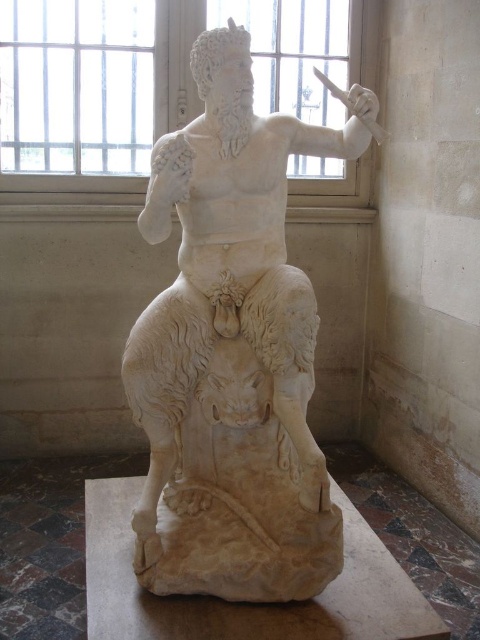
Question: Which of the following is the closest to the observer?

Choices:
 (A) white marble statue at center
 (B) clear glass window at upper center

Answer: (A)

Question: Which object appears farthest from the camera in this image?

Choices:
 (A) clear glass window at upper center
 (B) white marble statue at center

Answer: (A)

Question: Can you confirm if white marble statue at center is thinner than clear glass window at upper center?

Choices:
 (A) no
 (B) yes

Answer: (B)

Question: Is white marble statue at center to the left of clear glass window at upper center from the viewer's perspective?

Choices:
 (A) no
 (B) yes

Answer: (A)

Question: Does white marble statue at center have a larger size compared to clear glass window at upper center?

Choices:
 (A) no
 (B) yes

Answer: (A)